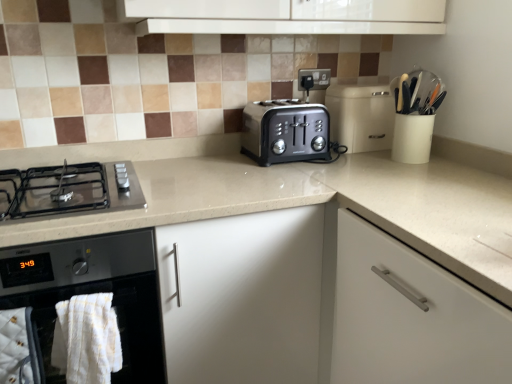
Question: Relative to satin black toaster at center, is beige plastic bread bin at center in front or behind?

Choices:
 (A) front
 (B) behind

Answer: (B)

Question: Looking at their shapes, would you say beige plastic bread bin at center is wider or thinner than satin black toaster at center?

Choices:
 (A) thin
 (B) wide

Answer: (A)

Question: Based on their relative distances, which object is farther from the beige glossy countertop at center?

Choices:
 (A) black glass oven at lower left
 (B) satin black toaster at center
 (C) white fluffy bath towel at lower left
 (D) beige plastic bread bin at center
 (E) black matte gas stove at lower left

Answer: (C)

Question: Estimate the real-world distances between objects in this image. Which object is farther from the beige glossy countertop at center?

Choices:
 (A) black glass oven at lower left
 (B) satin black toaster at center
 (C) black matte gas stove at lower left
 (D) white fluffy bath towel at lower left
 (E) beige plastic bread bin at center

Answer: (D)